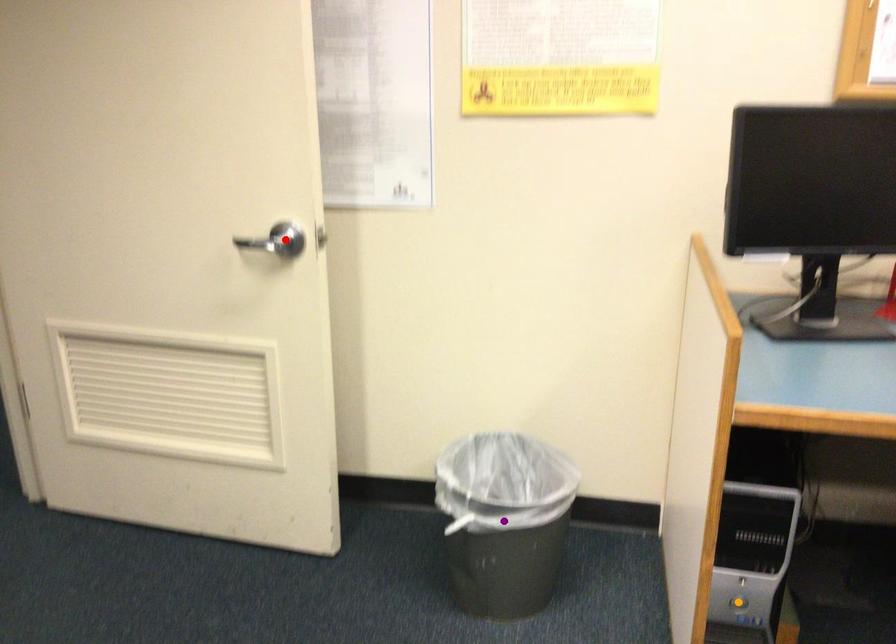
Order these from farthest to nearest:
red point
orange point
purple point

red point, purple point, orange point